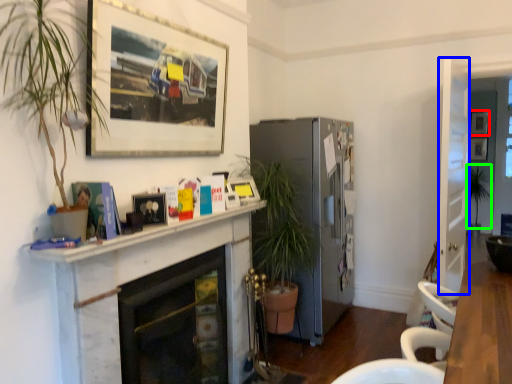
Question: Which object is the farthest from picture frame (highlighted by a red box)? Choose among these: glass door (highlighted by a blue box) or plant (highlighted by a green box).

Choices:
 (A) glass door
 (B) plant

Answer: (A)